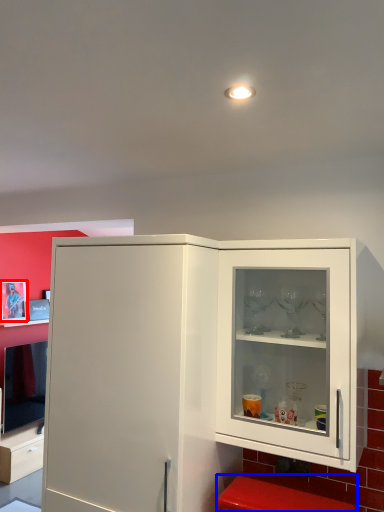
Question: Which object is closer to the camera taking this photo, picture frame (highlighted by a red box) or step stool (highlighted by a blue box)?

Choices:
 (A) picture frame
 (B) step stool

Answer: (B)